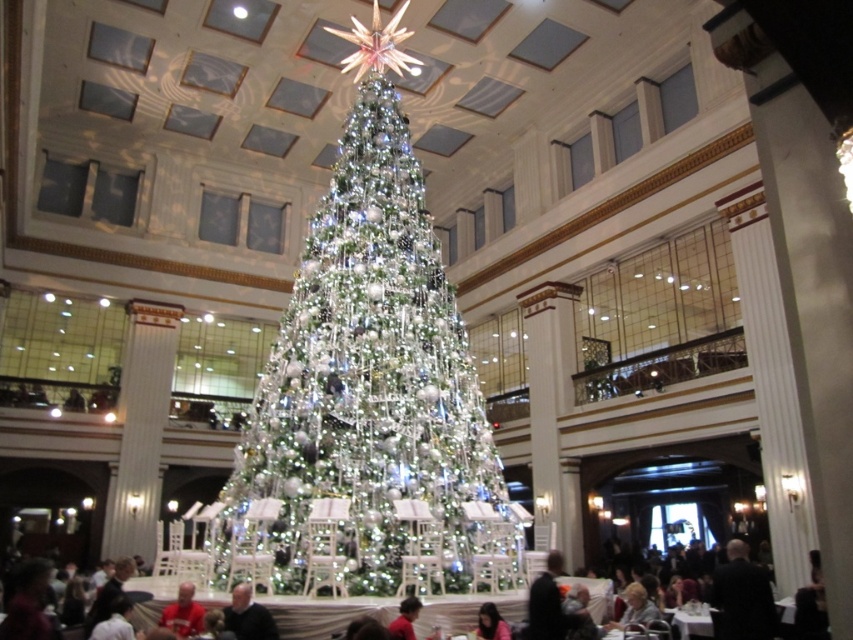
You are organizing a Christmas event and need to decide which garment to display on a mannequin. The mannequin can only accommodate garments with a minimum size requirement of 1.2 meters in length. Given the red velvet sweater at lower center and the red fabric shirt at lower center, which one is more likely to fit based on their sizes?

The red velvet sweater at lower center has a larger size compared to the red fabric shirt at lower center, so it is more likely to meet the mannequin size requirement of 1.2 meters in length.

You are organizing a photo shoot and need to ensure the iridescent glass christmas tree at center and the red velvet sweater at lower center are both visible in the frame. Given that the tree is much taller, will you need to adjust your camera angle to accommodate their sizes?

The iridescent glass christmas tree at center is larger than the red velvet sweater at lower center, so you will need to adjust your camera angle to ensure both are fully visible in the frame, possibly by tilting the camera slightly upwards to capture the height of the tree while keeping the sweater in view.

You are attending a Christmas event and see two guests dressed in a dark gray suit at lower right and a red fabric shirt at lower center. Which guest is positioned more to the right side of the scene?

The dark gray suit at lower right is positioned to the right of the red fabric shirt at lower center, so the guest in the dark gray suit at lower right is more to the right side of the scene.